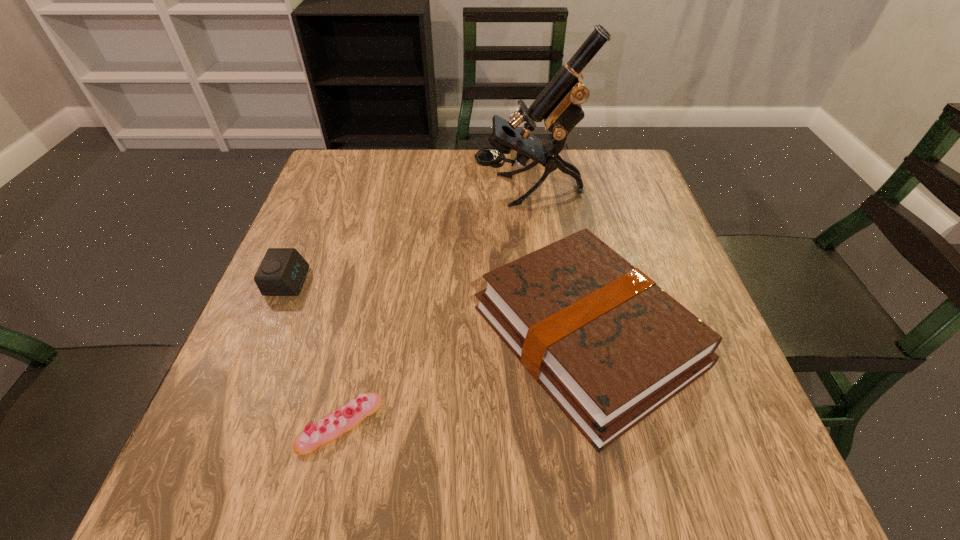
The height and width of the screenshot is (540, 960). Identify the location of object present at the near right corner. (610, 347).

Locate an element on the screen. The width and height of the screenshot is (960, 540). blank space at the far edge of the desktop is located at coordinates (574, 182).

In the image, there is a desktop. In order to click on free region at the near edge in this screenshot , I will do `click(613, 462)`.

In the image, there is a desktop. At what (x,y) coordinates should I click in order to perform the action: click on free space at the left edge. Please return your answer as a coordinate pair (x, y). Image resolution: width=960 pixels, height=540 pixels. Looking at the image, I should click on (301, 341).

This screenshot has height=540, width=960. In order to click on vacant space at the right edge of the desktop in this screenshot , I will do `click(720, 360)`.

The height and width of the screenshot is (540, 960). What are the coordinates of `free space at the far left corner` in the screenshot? It's located at (361, 161).

At what (x,y) coordinates should I click in order to perform the action: click on vacant space at the near left corner of the desktop. Please return your answer as a coordinate pair (x, y). The image size is (960, 540). Looking at the image, I should click on (236, 496).

Identify the location of free region at the far right corner of the desktop. Image resolution: width=960 pixels, height=540 pixels. (604, 197).

Locate an element on the screen. The width and height of the screenshot is (960, 540). free region at the near right corner of the desktop is located at coordinates (725, 452).

I want to click on free point between the eclair and the third shortest object, so click(464, 380).